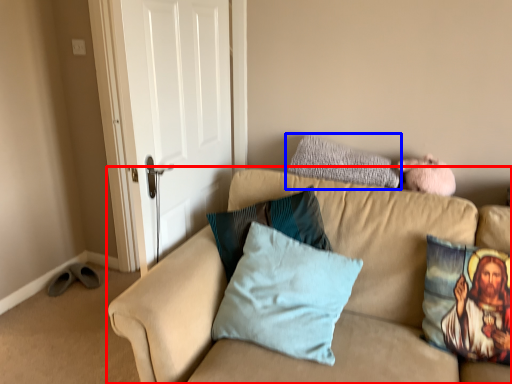
Question: Among these objects, which one is nearest to the camera, studio couch (highlighted by a red box) or pillow (highlighted by a blue box)?

Choices:
 (A) studio couch
 (B) pillow

Answer: (A)